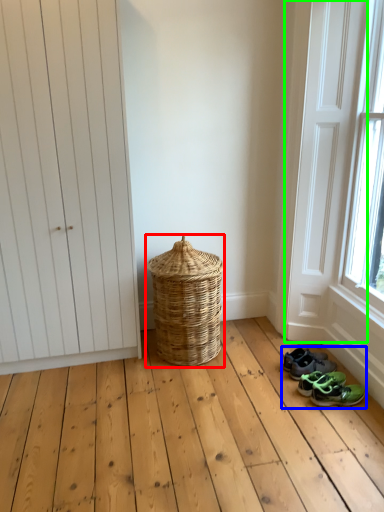
Question: Which object is positioned closest to basket (highlighted by a red box)? Select from footwear (highlighted by a blue box) and screen door (highlighted by a green box).

Choices:
 (A) footwear
 (B) screen door

Answer: (A)